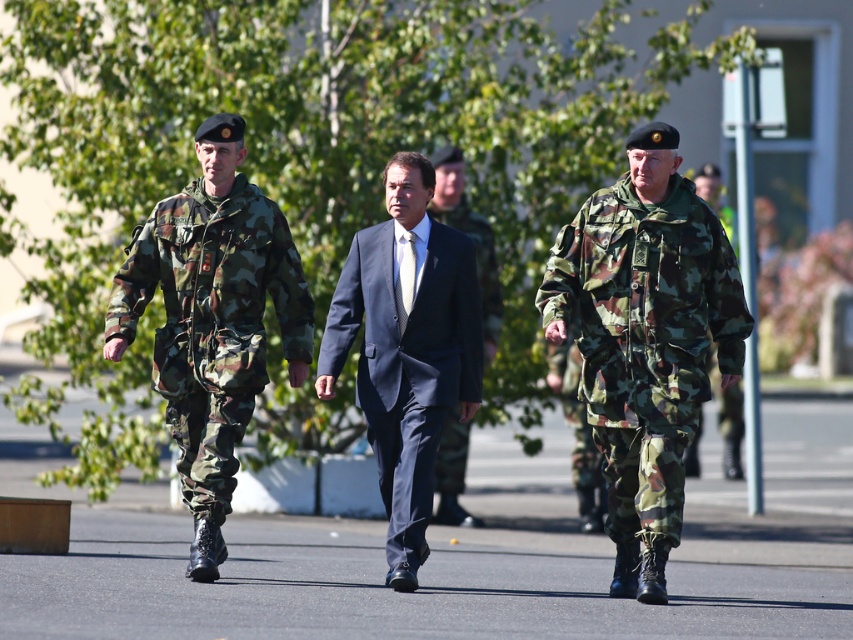
Question: Observing the image, what is the correct spatial positioning of camo fabric uniform at center in reference to dark blue suit at center?

Choices:
 (A) right
 (B) left

Answer: (A)

Question: Can you confirm if camouflage fabric uniform at left is bigger than dark blue suit at center?

Choices:
 (A) yes
 (B) no

Answer: (A)

Question: Among these objects, which one is nearest to the camera?

Choices:
 (A) dark blue suit at center
 (B) camouflage fabric uniform at right
 (C) navy blue suit at center

Answer: (B)

Question: Which of the following is the farthest from the observer?

Choices:
 (A) (698, 220)
 (B) (299, 323)
 (C) (697, 449)

Answer: (C)

Question: Does dark blue suit at center come in front of camouflage fabric uniform at right?

Choices:
 (A) no
 (B) yes

Answer: (A)

Question: Among these objects, which one is nearest to the camera?

Choices:
 (A) camo fabric uniform at center
 (B) navy blue suit at center
 (C) camouflage fabric uniform at right

Answer: (A)